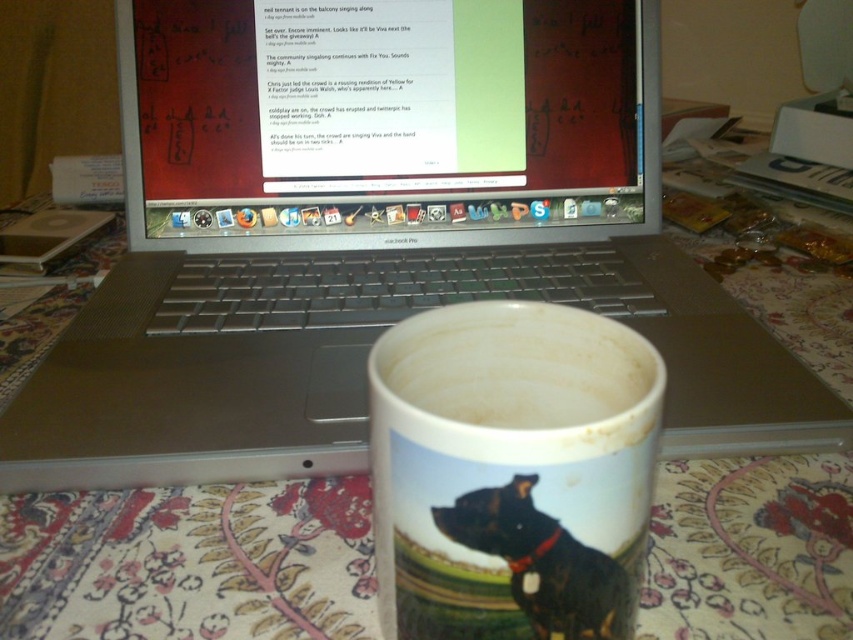
Question: Which point is closer to the camera?

Choices:
 (A) (531, 561)
 (B) (595, 148)

Answer: (A)

Question: Which point is closer to the camera?

Choices:
 (A) (450, 552)
 (B) (294, 40)
 (C) (627, 612)

Answer: (A)

Question: Among these points, which one is nearest to the camera?

Choices:
 (A) (451, 612)
 (B) (572, 573)

Answer: (B)

Question: Can you confirm if white glossy mug at center is positioned above black glossy dog at center?

Choices:
 (A) no
 (B) yes

Answer: (B)

Question: In this image, where is white glossy mug at center located relative to black glossy dog at center?

Choices:
 (A) right
 (B) left

Answer: (B)

Question: Does matte plastic monitor at center have a greater width compared to black glossy dog at center?

Choices:
 (A) no
 (B) yes

Answer: (B)